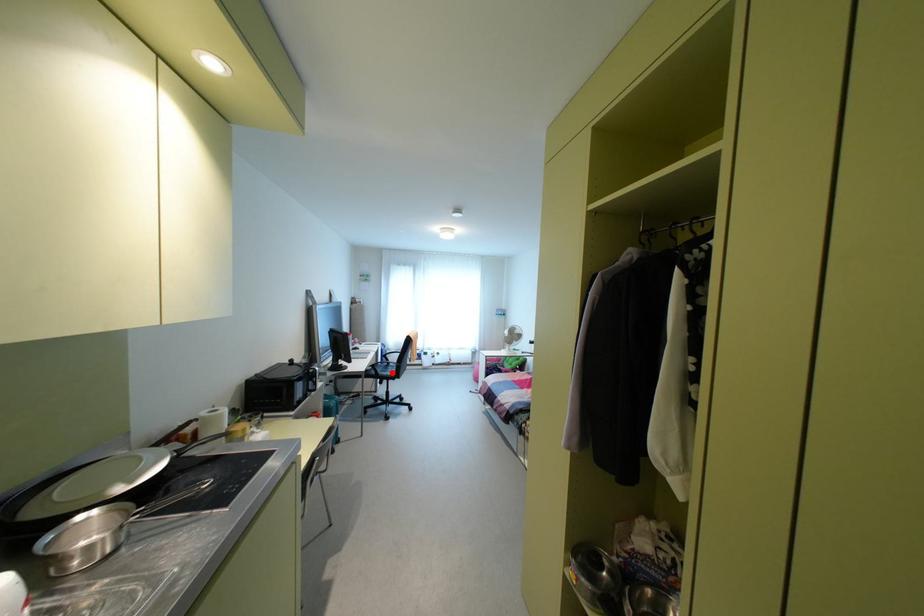
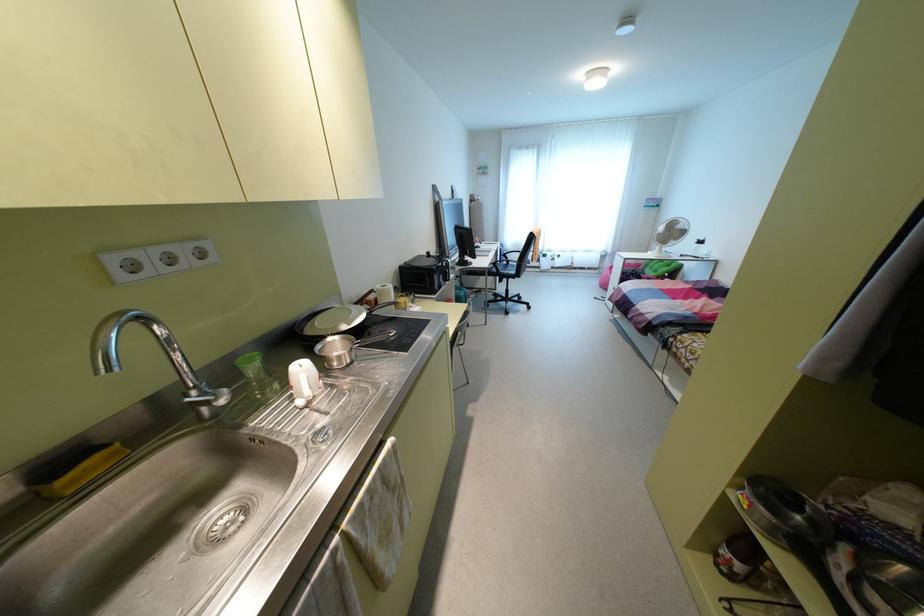
Locate, in the second image, the point that corresponds to the highlighted location in the first image.

(513, 272)